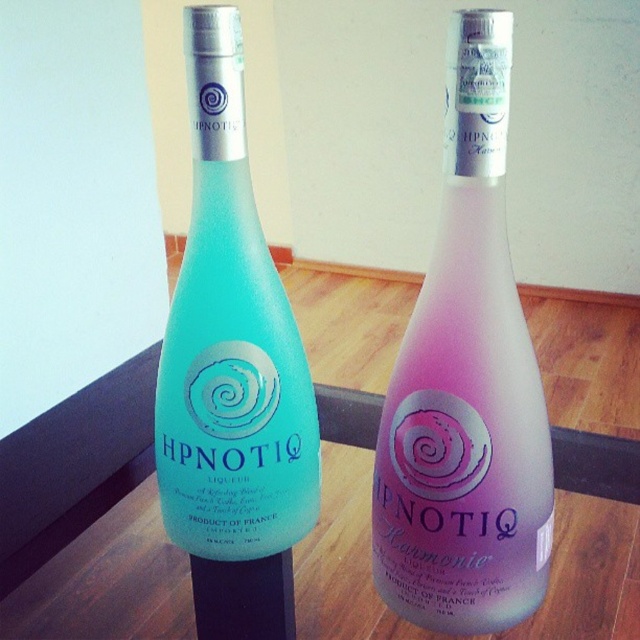
Question: Which point is closer to the camera?

Choices:
 (A) (157, 404)
 (B) (397, 554)

Answer: (B)

Question: Does pink glass bottle at center have a lesser width compared to matte glass bottle at left?

Choices:
 (A) no
 (B) yes

Answer: (B)

Question: Does pink glass bottle at center appear under matte glass bottle at left?

Choices:
 (A) no
 (B) yes

Answer: (A)

Question: Which object is closer to the camera taking this photo?

Choices:
 (A) matte glass bottle at left
 (B) pink glass bottle at center

Answer: (B)

Question: Is pink glass bottle at center positioned behind matte glass bottle at left?

Choices:
 (A) no
 (B) yes

Answer: (A)